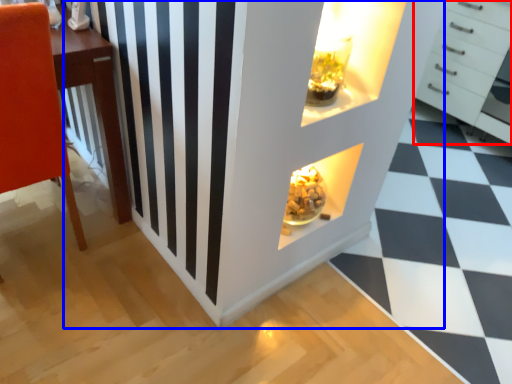
Question: Among these objects, which one is farthest to the camera, chest of drawers (highlighted by a red box) or dresser (highlighted by a blue box)?

Choices:
 (A) chest of drawers
 (B) dresser

Answer: (A)